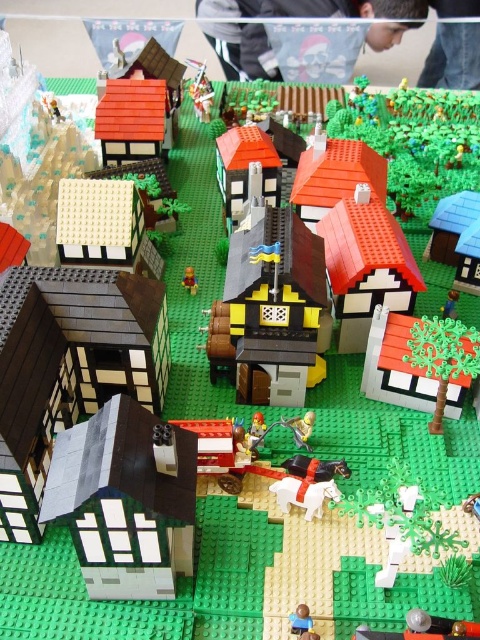
Locate an element on the screen. The width and height of the screenshot is (480, 640). matte gray house at lower left is located at coordinates coord(124,500).

Can you confirm if matte gray house at lower left is positioned below smooth yellow minifigure at center?

Correct, matte gray house at lower left is located below smooth yellow minifigure at center.

The width and height of the screenshot is (480, 640). Describe the element at coordinates (124, 500) in the screenshot. I see `matte gray house at lower left` at that location.

At what (x,y) coordinates should I click in order to perform the action: click on matte gray house at lower left. Please return your answer as a coordinate pair (x, y). Image resolution: width=480 pixels, height=640 pixels. Looking at the image, I should click on (124, 500).